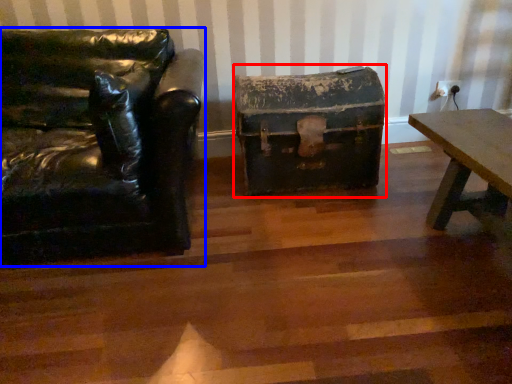
Question: Which of the following is the closest to the observer, box (highlighted by a red box) or chair (highlighted by a blue box)?

Choices:
 (A) box
 (B) chair

Answer: (B)